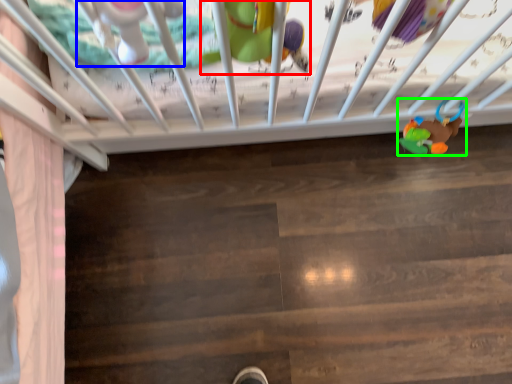
Question: Estimate the real-world distances between objects in this image. Which object is closer to toy (highlighted by a red box), toy (highlighted by a blue box) or toy (highlighted by a green box)?

Choices:
 (A) toy
 (B) toy

Answer: (A)